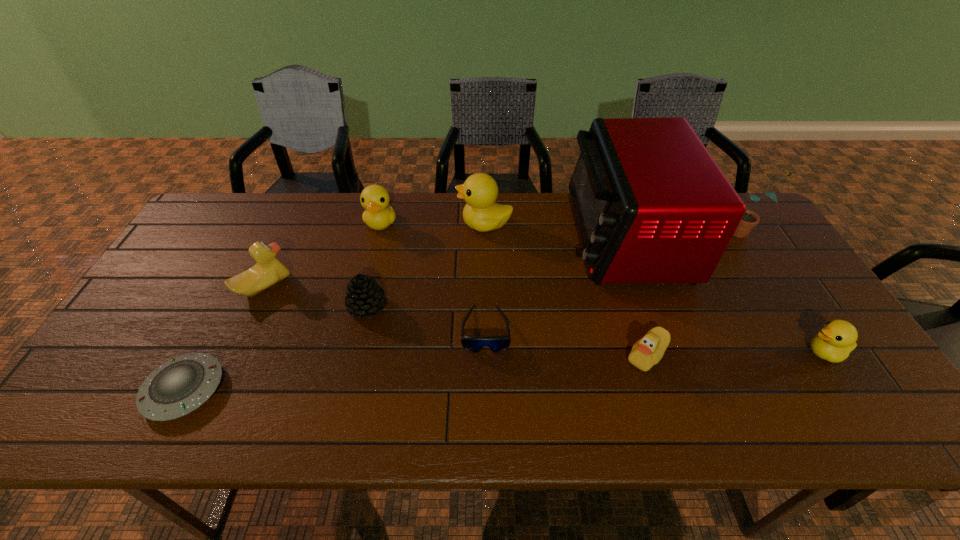
This screenshot has width=960, height=540. I want to click on red toaster oven, so click(652, 206).

I want to click on toaster oven, so click(652, 206).

Identify the location of the ninth shortest object. (750, 219).

Find the location of a particular element. Image resolution: width=960 pixels, height=540 pixels. the tallest duck is located at coordinates (481, 213).

Find the location of a particular element. Image resolution: width=960 pixels, height=540 pixels. the third duck from right to left is located at coordinates click(481, 213).

I want to click on the second duck from left to right, so click(378, 215).

You are a GUI agent. You are given a task and a screenshot of the screen. Output one action in this format:
    pyautogui.click(x=<x>, y=<y>)
    Task: Click on the leftmost yellow duck
    The image size is (960, 540).
    Given the screenshot: What is the action you would take?
    pyautogui.click(x=378, y=215)

Locate an element on the screen. This screenshot has width=960, height=540. the leftmost duck is located at coordinates (269, 270).

Identify the location of the left beige duck. (269, 270).

At what (x,y) coordinates should I click in order to perform the action: click on pinecone. Please return your answer as a coordinate pair (x, y). Image resolution: width=960 pixels, height=540 pixels. Looking at the image, I should click on (364, 296).